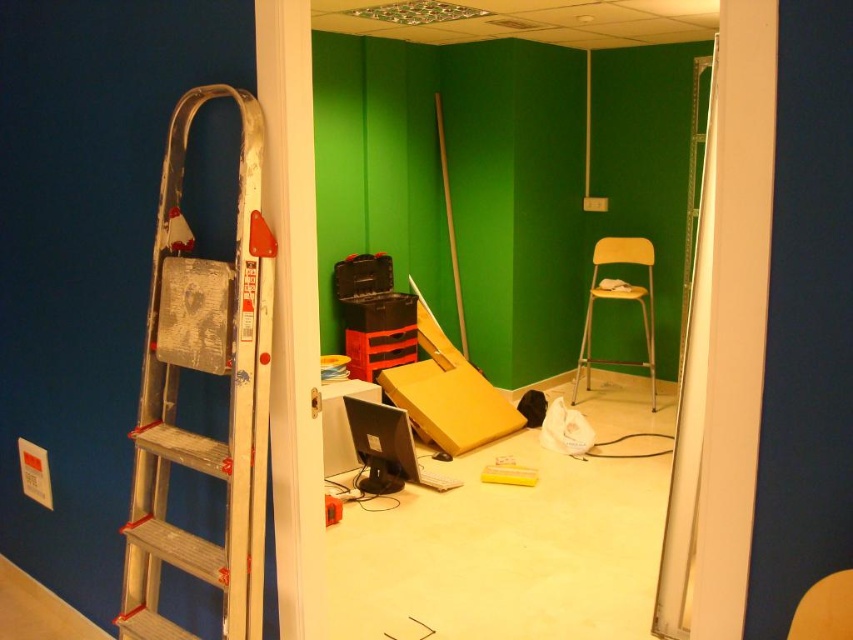
Is yellow plastic chair at center to the left of matte black monitor at center from the viewer's perspective?

In fact, yellow plastic chair at center is to the right of matte black monitor at center.

Which is in front, point (577, 365) or point (379, 422)?

Point (379, 422) is in front.

Where is `yellow plastic chair at center`? This screenshot has height=640, width=853. yellow plastic chair at center is located at coordinates (619, 300).

Who is more distant from viewer, (x=149, y=580) or (x=354, y=416)?

Point (x=354, y=416)

Who is more forward, (201, 268) or (408, 467)?

Point (201, 268) is more forward.

Where is `silver metallic ladder at left`? silver metallic ladder at left is located at coordinates [x=206, y=372].

Does silver metallic ladder at left have a larger size compared to matte orange chair at center?

Yes, silver metallic ladder at left is bigger than matte orange chair at center.

Does silver metallic ladder at left appear over matte orange chair at center?

Indeed, silver metallic ladder at left is positioned over matte orange chair at center.

Image resolution: width=853 pixels, height=640 pixels. In order to click on silver metallic ladder at left in this screenshot , I will do `click(206, 372)`.